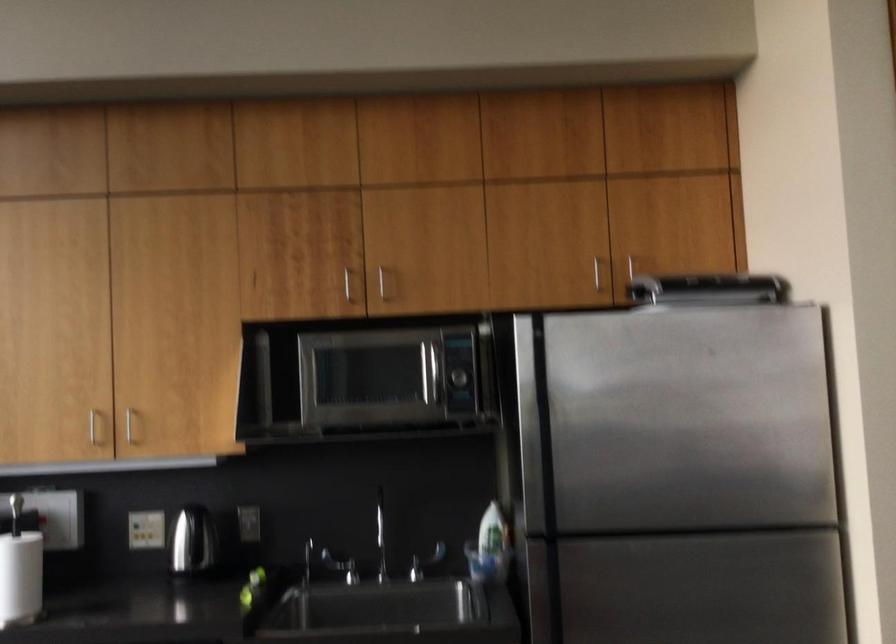
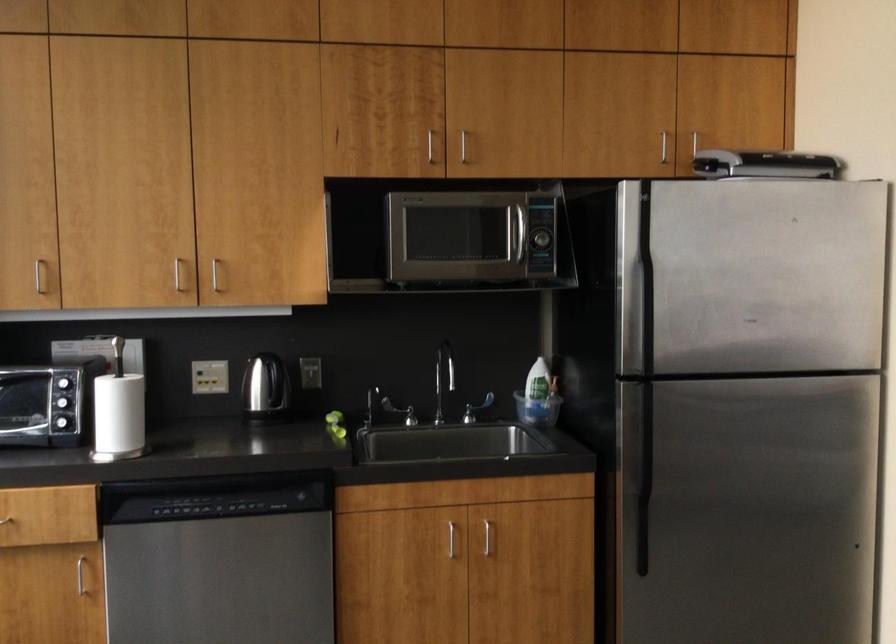
Question: In a continuous first-person perspective shot, in which direction is the camera moving?

Choices:
 (A) Left
 (B) Right
 (C) Forward
 (D) Backward

Answer: (A)